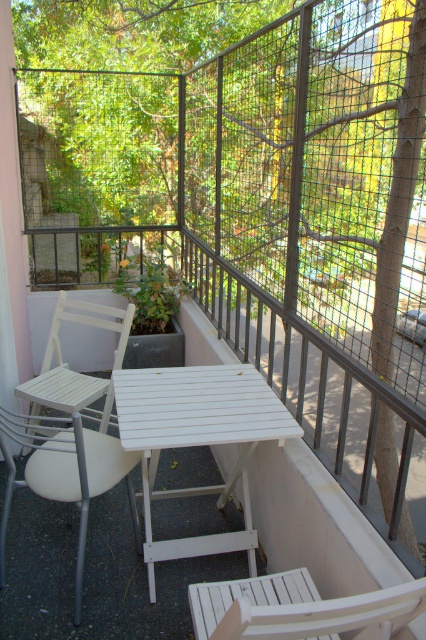
Question: Does white plastic chair at left have a smaller size compared to white wood chair at lower center?

Choices:
 (A) no
 (B) yes

Answer: (A)

Question: Which object is farther from the camera taking this photo?

Choices:
 (A) white wood chair at left
 (B) white wood chair at lower center
 (C) white wood table at center

Answer: (A)

Question: Does white wood table at center have a smaller size compared to white wood chair at left?

Choices:
 (A) no
 (B) yes

Answer: (B)

Question: In this image, where is white plastic chair at left located relative to white wood chair at left?

Choices:
 (A) above
 (B) below

Answer: (B)

Question: Which point is farther to the camera?

Choices:
 (A) (166, 417)
 (B) (22, 436)
 (C) (247, 611)
 (D) (48, 346)

Answer: (D)

Question: Which point is closer to the camera?

Choices:
 (A) (351, 596)
 (B) (5, 410)
 (C) (97, 323)

Answer: (A)